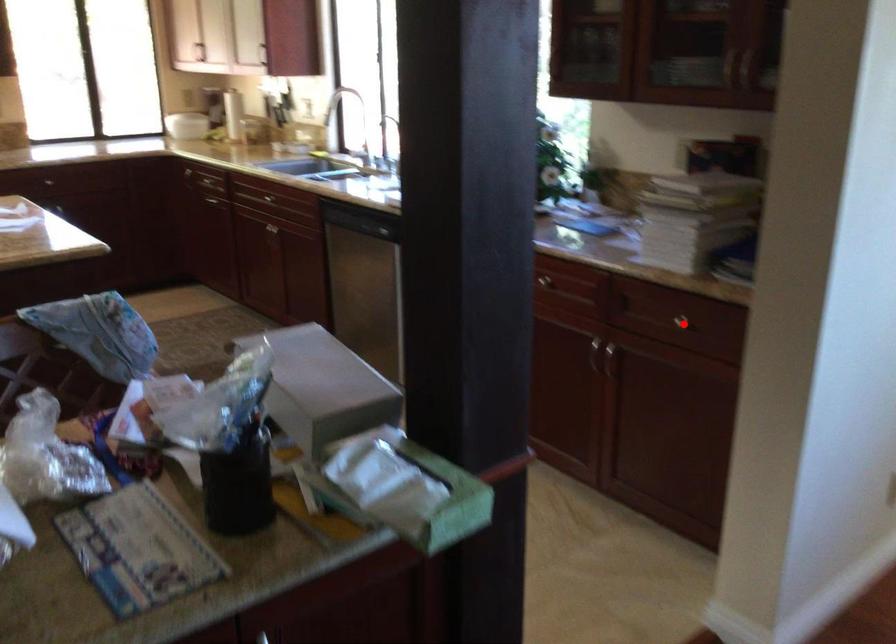
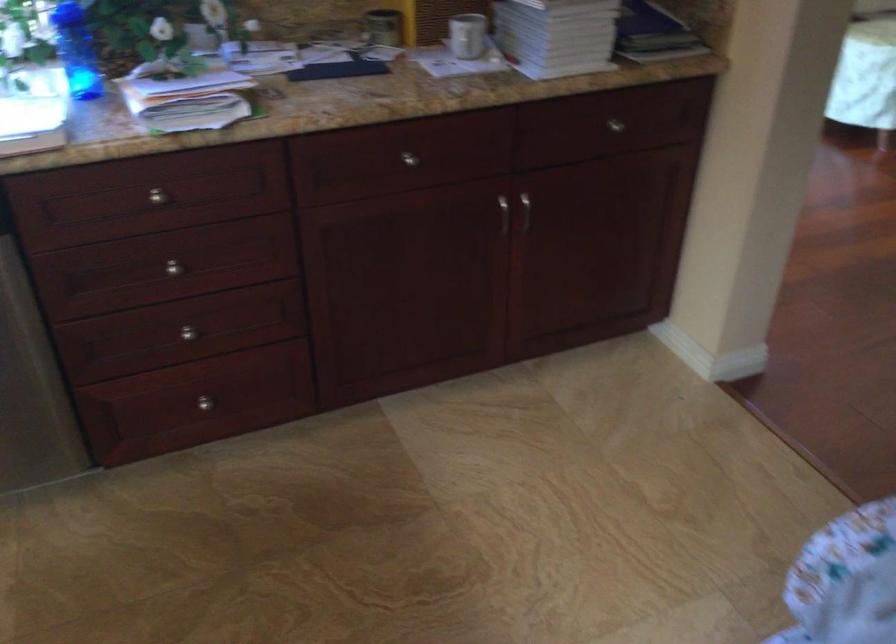
Where in the second image is the point corresponding to the highlighted location from the first image?

(615, 125)